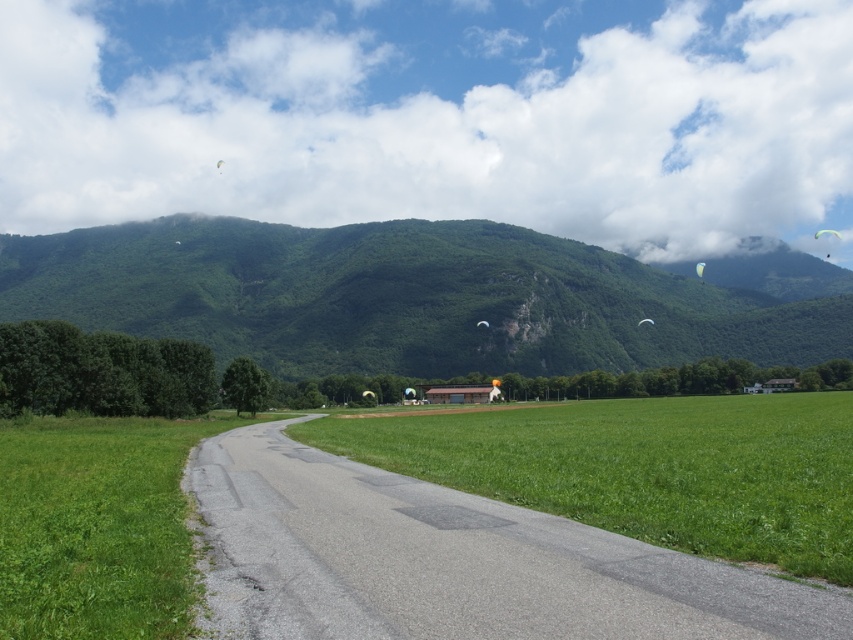
Question: Can you confirm if green leafy mountain at center is positioned to the left of green grass field at center?

Choices:
 (A) no
 (B) yes

Answer: (A)

Question: Which object is farther from the camera taking this photo?

Choices:
 (A) white fabric kite at upper right
 (B) green fabric kite at upper right

Answer: (B)

Question: Which point is closer to the camera?

Choices:
 (A) white fabric kite at upper right
 (B) green fabric kite at upper right

Answer: (A)

Question: Which of the following is the farthest from the observer?

Choices:
 (A) (596, 404)
 (B) (817, 230)

Answer: (B)

Question: Can you confirm if green grass field at center is positioned below green fabric kite at upper right?

Choices:
 (A) yes
 (B) no

Answer: (A)

Question: Is green leafy mountain at center further to camera compared to green fabric kite at upper right?

Choices:
 (A) no
 (B) yes

Answer: (A)